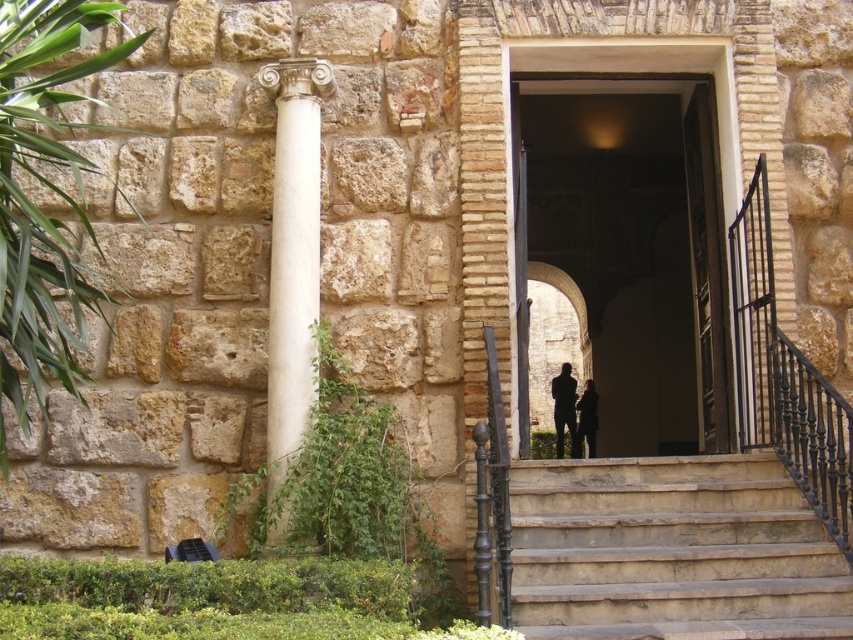
Question: Based on their relative distances, which object is nearer to the smooth stone archway at center?

Choices:
 (A) white marble column at center-left
 (B) dark gray suit at center
 (C) dark fabric figure at center

Answer: (B)

Question: Observing the image, what is the correct spatial positioning of smooth stone archway at center in reference to white marble column at center-left?

Choices:
 (A) below
 (B) above

Answer: (B)

Question: Among these points, which one is farthest from the camera?

Choices:
 (A) (564, 612)
 (B) (660, 211)
 (C) (560, 422)

Answer: (B)

Question: Considering the relative positions of smooth stone archway at center and white marble column at center-left in the image provided, where is smooth stone archway at center located with respect to white marble column at center-left?

Choices:
 (A) below
 (B) above

Answer: (B)

Question: Does white marble column at center-left have a larger size compared to dark fabric figure at center?

Choices:
 (A) no
 (B) yes

Answer: (B)

Question: Which of these objects is positioned farthest from the dark gray suit at center?

Choices:
 (A) brown stone stairs at center
 (B) white marble column at center-left
 (C) smooth stone archway at center
 (D) dark fabric figure at center

Answer: (A)